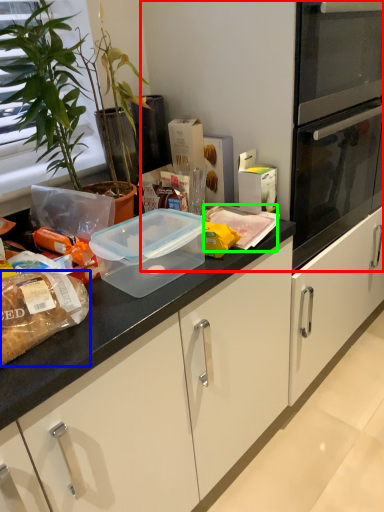
Question: Considering the real-world distances, which object is farthest from fridge (highlighted by a red box)? food (highlighted by a blue box) or food (highlighted by a green box)?

Choices:
 (A) food
 (B) food

Answer: (A)